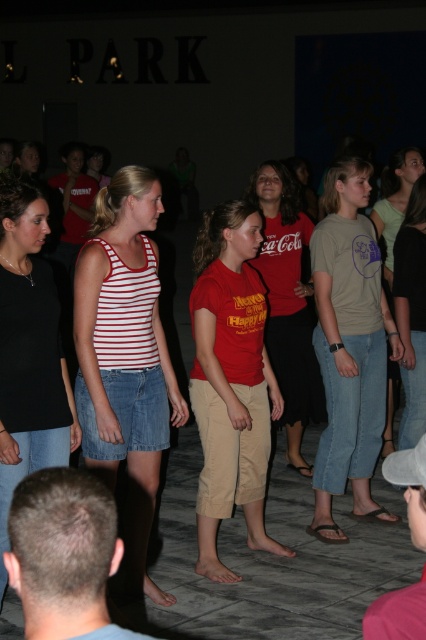
Between point (25, 390) and point (304, 365), which one is positioned behind?

The point (304, 365) is behind.

Between black matte tank top at center and matte red shirt at center, which one is positioned higher?

matte red shirt at center

Who is more distant from viewer, (x=2, y=323) or (x=301, y=435)?

Positioned behind is point (x=301, y=435).

The height and width of the screenshot is (640, 426). Find the location of `black matte tank top at center`. black matte tank top at center is located at coordinates (28, 352).

Who is higher up, striped cotton tank top at center or light brown cotton shirt at center?

light brown cotton shirt at center is above.

From the picture: Between striped cotton tank top at center and light brown cotton shirt at center, which one has more height?

light brown cotton shirt at center

Where is `striped cotton tank top at center`? This screenshot has height=640, width=426. striped cotton tank top at center is located at coordinates (124, 353).

You are a GUI agent. You are given a task and a screenshot of the screen. Output one action in this format:
    pyautogui.click(x=<x>, y=<y>)
    Task: Click on the striped cotton tank top at center
    The image size is (426, 640).
    Given the screenshot: What is the action you would take?
    pyautogui.click(x=124, y=353)

Who is more forward, (173, 413) or (301, 212)?

Point (173, 413) is in front.

Locate an element on the screen. The image size is (426, 640). striped cotton tank top at center is located at coordinates (124, 353).

Identify the location of striped cotton tank top at center. This screenshot has width=426, height=640. (124, 353).